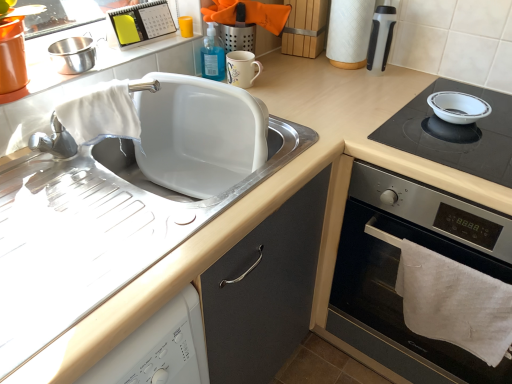
Where is `free area behind matte ceramic mug at upper center, acting as the third appliance starting from the left`? The width and height of the screenshot is (512, 384). free area behind matte ceramic mug at upper center, acting as the third appliance starting from the left is located at coordinates (275, 70).